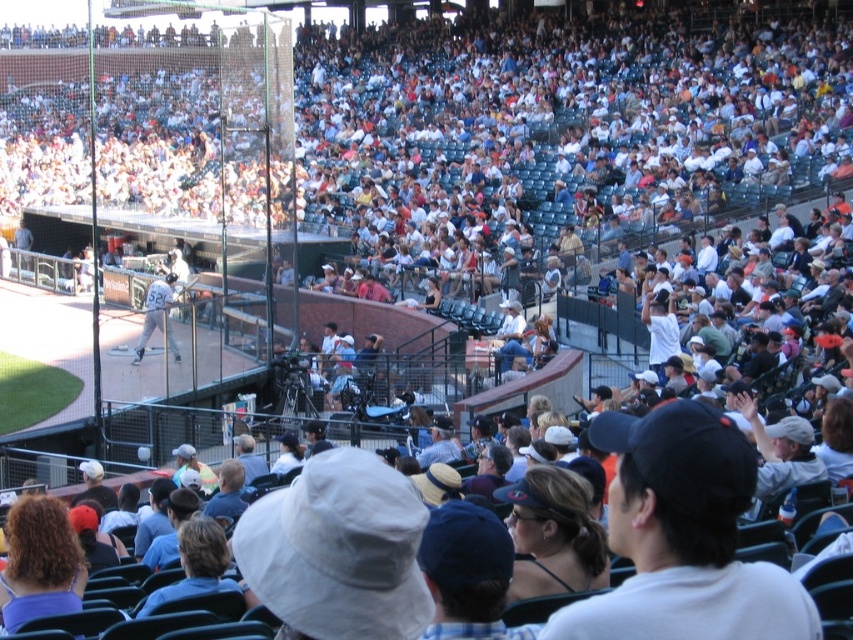
Question: Is light brown hair at lower center to the left of matte gray uniform at center from the viewer's perspective?

Choices:
 (A) no
 (B) yes

Answer: (A)

Question: Which point is closer to the camera taking this photo?

Choices:
 (A) (213, 529)
 (B) (173, 342)

Answer: (A)

Question: Is light brown hair at lower center thinner than matte gray uniform at center?

Choices:
 (A) yes
 (B) no

Answer: (A)

Question: Among these objects, which one is farthest from the camera?

Choices:
 (A) light brown hair at lower center
 (B) matte gray uniform at center

Answer: (B)

Question: Does light brown hair at lower center appear over matte gray uniform at center?

Choices:
 (A) yes
 (B) no

Answer: (B)